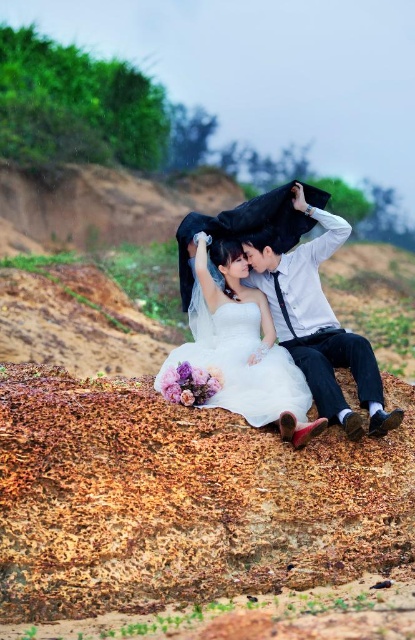
Locate an element on the screen. Image resolution: width=415 pixels, height=640 pixels. white satin shirt at center is located at coordinates (315, 314).

Is white satin shirt at center to the right of white satin dress at center from the viewer's perspective?

Indeed, white satin shirt at center is positioned on the right side of white satin dress at center.

Between point (304, 316) and point (244, 353), which one is positioned in front?

Point (244, 353)

You are a GUI agent. You are given a task and a screenshot of the screen. Output one action in this format:
    pyautogui.click(x=<x>, y=<y>)
    Task: Click on the white satin shirt at center
    
    Given the screenshot: What is the action you would take?
    pyautogui.click(x=315, y=314)